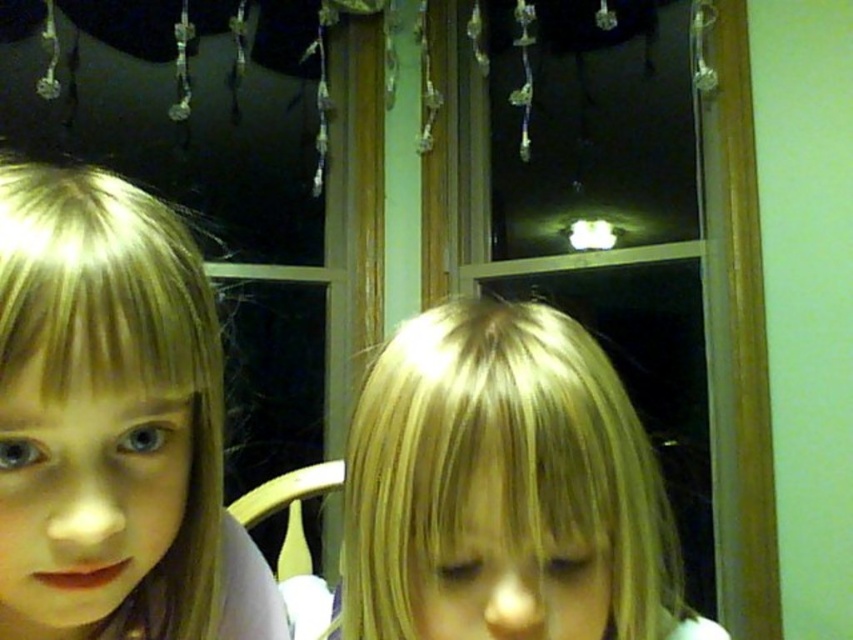
Does blonde hair at left come in front of blonde hair at center?

That is True.

From the picture: Does blonde hair at left appear under blonde hair at center?

Indeed, blonde hair at left is positioned under blonde hair at center.

Which is behind, point (141, 209) or point (648, 570)?

The point (648, 570) is behind.

Where is `blonde hair at left`? blonde hair at left is located at coordinates (113, 420).